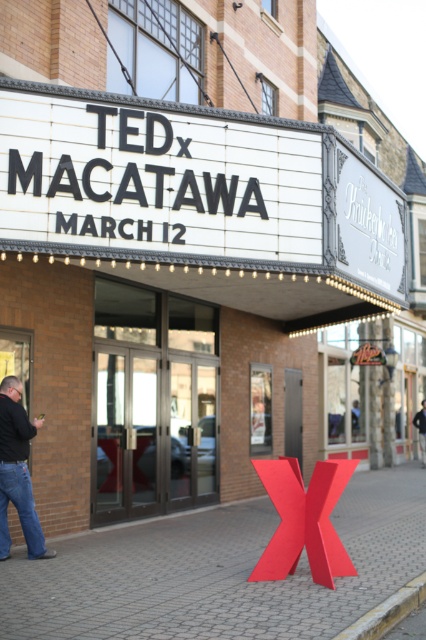
Does dark blue jeans at lower left have a lesser height compared to dark blue jeans at center?

No.

Describe the element at coordinates (17, 470) in the screenshot. I see `dark blue jeans at lower left` at that location.

You are a GUI agent. You are given a task and a screenshot of the screen. Output one action in this format:
    pyautogui.click(x=<x>, y=<y>)
    Task: Click on the dark blue jeans at lower left
    
    Given the screenshot: What is the action you would take?
    pyautogui.click(x=17, y=470)

Locate an element on the screen. This screenshot has height=640, width=426. dark blue jeans at lower left is located at coordinates (17, 470).

Is point (362, 579) closer to viewer compared to point (412, 419)?

Yes, it is in front of point (412, 419).

Where is `matte red x at center`? Image resolution: width=426 pixels, height=640 pixels. matte red x at center is located at coordinates (216, 572).

Does point (132, 538) come behind point (422, 429)?

No, it is in front of (422, 429).

Where is `matte red x at center`? matte red x at center is located at coordinates (216, 572).

Does matte red x at center have a lesser height compared to dark blue jeans at lower left?

Yes, matte red x at center is shorter than dark blue jeans at lower left.

Does matte red x at center appear on the right side of dark blue jeans at lower left?

Correct, you'll find matte red x at center to the right of dark blue jeans at lower left.

What do you see at coordinates (216, 572) in the screenshot? Image resolution: width=426 pixels, height=640 pixels. I see `matte red x at center` at bounding box center [216, 572].

Identify the location of matte red x at center. (216, 572).